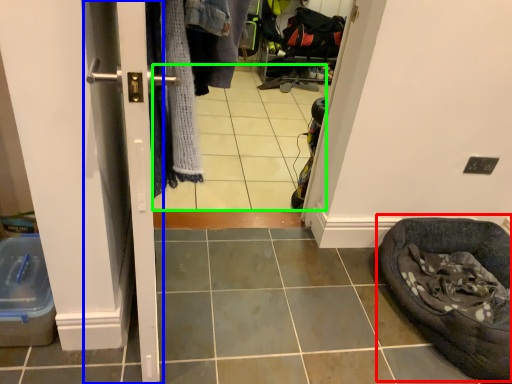
Question: Which object is the farthest from bean bag chair (highlighted by a red box)? Choose among these: screen door (highlighted by a blue box) or tile (highlighted by a green box).

Choices:
 (A) screen door
 (B) tile

Answer: (B)